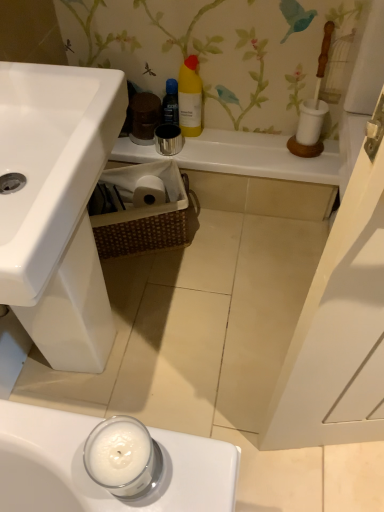
Image resolution: width=384 pixels, height=512 pixels. What do you see at coordinates (257, 157) in the screenshot?
I see `white ceramic counter top at upper center` at bounding box center [257, 157].

Where is `brown woven basket at lower center`? This screenshot has width=384, height=512. brown woven basket at lower center is located at coordinates (139, 211).

Where is `black plastic spray can at upper center`? black plastic spray can at upper center is located at coordinates [x=171, y=103].

Is brown woven basket at lower center placed right next to black plastic spray can at upper center?

No, brown woven basket at lower center is not touching black plastic spray can at upper center.

Is black plastic spray can at upper center surrounded by brown woven basket at lower center?

No.

How many degrees apart are the facing directions of brown woven basket at lower center and black plastic spray can at upper center?

23.2 degrees separate the facing orientations of brown woven basket at lower center and black plastic spray can at upper center.

Is brown woven basket at lower center bigger than black plastic spray can at upper center?

Yes.

Is black plastic spray can at upper center not inside white ceramic counter top at upper center?

That's correct, black plastic spray can at upper center is outside of white ceramic counter top at upper center.

Considering the relative sizes of black plastic spray can at upper center and white ceramic counter top at upper center in the image provided, is black plastic spray can at upper center bigger than white ceramic counter top at upper center?

No.

From a real-world perspective, which is physically above, black plastic spray can at upper center or white ceramic counter top at upper center?

From a 3D spatial view, black plastic spray can at upper center is above.

Is black plastic spray can at upper center facing towards white ceramic counter top at upper center?

No.

Is yellow plastic bottle at upper center next to brown woven basket at lower center and touching it?

yellow plastic bottle at upper center and brown woven basket at lower center are not in contact.

Would you say brown woven basket at lower center is part of yellow plastic bottle at upper center's contents?

Actually, brown woven basket at lower center is outside yellow plastic bottle at upper center.

From a real-world perspective, is yellow plastic bottle at upper center under brown woven basket at lower center?

No, from a real-world perspective, yellow plastic bottle at upper center is not beneath brown woven basket at lower center.

Visually, is yellow plastic bottle at upper center positioned to the left or to the right of brown woven basket at lower center?

In the image, yellow plastic bottle at upper center appears on the right side of brown woven basket at lower center.

Is black plastic spray can at upper center in contact with brown woven basket at lower center?

No, black plastic spray can at upper center is not with brown woven basket at lower center.

Does black plastic spray can at upper center come in front of brown woven basket at lower center?

No.

In terms of height, does black plastic spray can at upper center look taller or shorter compared to brown woven basket at lower center?

Clearly, black plastic spray can at upper center is shorter compared to brown woven basket at lower center.

Is there a large distance between brown woven basket at lower center and yellow plastic bottle at upper center?

No, there isn't a large distance between brown woven basket at lower center and yellow plastic bottle at upper center.

Which of these two, brown woven basket at lower center or yellow plastic bottle at upper center, is thinner?

yellow plastic bottle at upper center.

Can yellow plastic bottle at upper center be found inside brown woven basket at lower center?

No, yellow plastic bottle at upper center is not surrounded by brown woven basket at lower center.

Which of these two, yellow plastic bottle at upper center or black plastic spray can at upper center, is thinner?

black plastic spray can at upper center is thinner.

Is yellow plastic bottle at upper center at the right side of black plastic spray can at upper center?

Indeed, yellow plastic bottle at upper center is positioned on the right side of black plastic spray can at upper center.

From a real-world perspective, who is located lower, yellow plastic bottle at upper center or black plastic spray can at upper center?

black plastic spray can at upper center is physically lower.

Which is more distant, (184, 68) or (173, 94)?

Positioned behind is point (173, 94).

Choose the correct answer: Is white ceramic counter top at upper center inside black plastic spray can at upper center or outside it?

white ceramic counter top at upper center is located beyond the bounds of black plastic spray can at upper center.

Which point is more forward, (x=211, y=157) or (x=166, y=85)?

The point (x=166, y=85) is closer to the camera.

Between white ceramic counter top at upper center and black plastic spray can at upper center, which one has more height?

With more height is black plastic spray can at upper center.

Is white ceramic counter top at upper center thinner than black plastic spray can at upper center?

In fact, white ceramic counter top at upper center might be wider than black plastic spray can at upper center.

At what (x,y) coordinates should I click in order to perform the action: click on bottle that appears above the brown woven basket at lower center (from a real-world perspective). Please return your answer as a coordinate pair (x, y). Image resolution: width=384 pixels, height=512 pixels. Looking at the image, I should click on (171, 103).

Image resolution: width=384 pixels, height=512 pixels. In order to click on bottle behind the white ceramic counter top at upper center in this screenshot , I will do `click(171, 103)`.

Which object lies nearer to the anchor point brown woven basket at lower center, black plastic spray can at upper center or white ceramic counter top at upper center?

Based on the image, white ceramic counter top at upper center appears to be nearer to brown woven basket at lower center.

Estimate the real-world distances between objects in this image. Which object is closer to black plastic spray can at upper center, yellow plastic bottle at upper center or brown woven basket at lower center?

Based on the image, yellow plastic bottle at upper center appears to be nearer to black plastic spray can at upper center.

Estimate the real-world distances between objects in this image. Which object is further from white ceramic counter top at upper center, black plastic spray can at upper center or yellow plastic bottle at upper center?

black plastic spray can at upper center is further to white ceramic counter top at upper center.

When comparing their distances from black plastic spray can at upper center, does white ceramic counter top at upper center or yellow plastic bottle at upper center seem further?

Among the two, white ceramic counter top at upper center is located further to black plastic spray can at upper center.

When comparing their distances from yellow plastic bottle at upper center, does black plastic spray can at upper center or brown woven basket at lower center seem further?

The object further to yellow plastic bottle at upper center is brown woven basket at lower center.

Looking at the image, which one is located closer to black plastic spray can at upper center, yellow plastic bottle at upper center or white ceramic counter top at upper center?

Among the two, yellow plastic bottle at upper center is located nearer to black plastic spray can at upper center.

Which object lies further to the anchor point brown woven basket at lower center, black plastic spray can at upper center or yellow plastic bottle at upper center?

black plastic spray can at upper center is further to brown woven basket at lower center.

Estimate the real-world distances between objects in this image. Which object is further from yellow plastic bottle at upper center, white ceramic counter top at upper center or brown woven basket at lower center?

Based on the image, brown woven basket at lower center appears to be further to yellow plastic bottle at upper center.

I want to click on counter top that lies between black plastic spray can at upper center and brown woven basket at lower center from top to bottom, so click(x=257, y=157).

Locate an element on the screen. counter top that lies between yellow plastic bottle at upper center and brown woven basket at lower center from top to bottom is located at coordinates (257, 157).

Where is `bottle between yellow plastic bottle at upper center and brown woven basket at lower center in the up-down direction`? bottle between yellow plastic bottle at upper center and brown woven basket at lower center in the up-down direction is located at coordinates (171, 103).

Where is `cleaning product situated between black plastic spray can at upper center and white ceramic counter top at upper center from left to right`? This screenshot has width=384, height=512. cleaning product situated between black plastic spray can at upper center and white ceramic counter top at upper center from left to right is located at coordinates (190, 98).